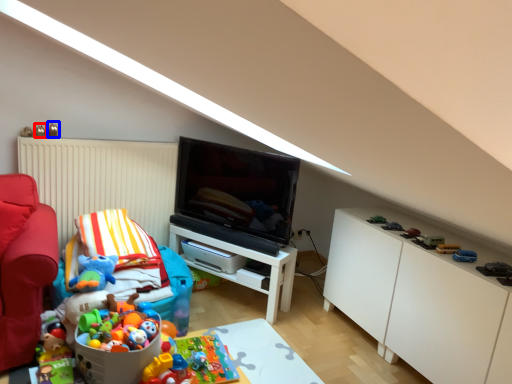
Question: Which object is further to the camera taking this photo, toy (highlighted by a red box) or toy (highlighted by a blue box)?

Choices:
 (A) toy
 (B) toy

Answer: (B)